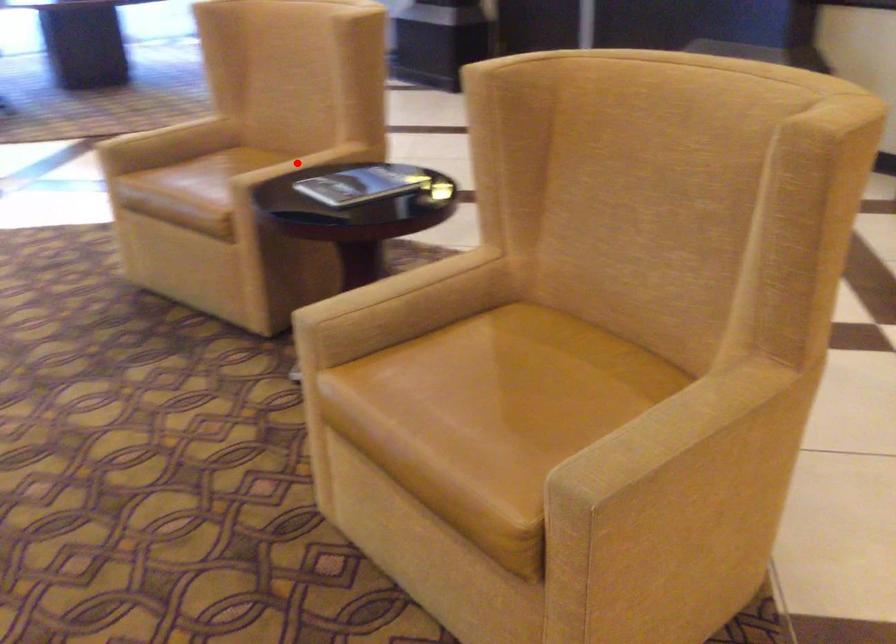
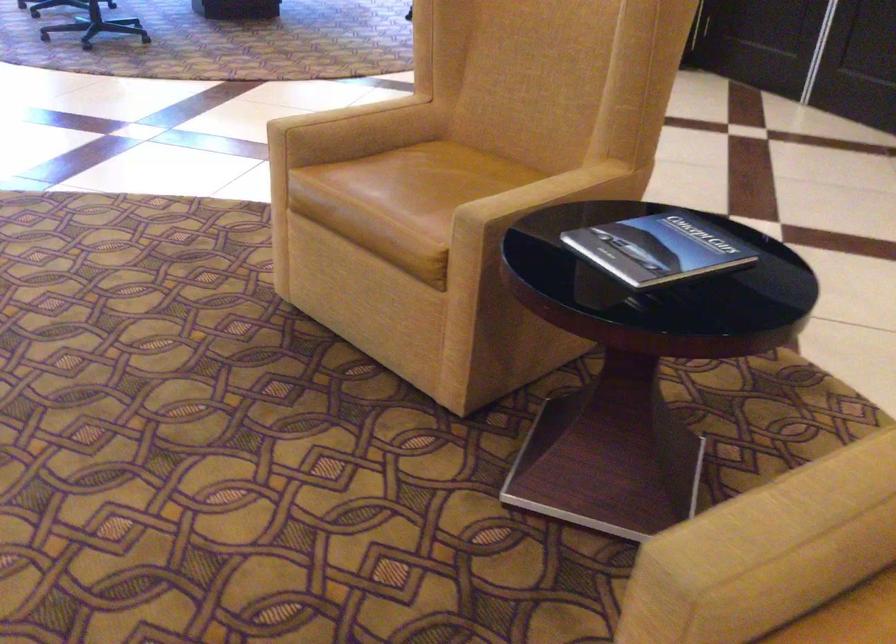
Question: I am providing you with two images of the same scene from different viewpoints. In image1, a red point is highlighted. Considering the same 3D point in image2, which of the following is correct?

Choices:
 (A) It is closer
 (B) It is farther

Answer: (A)